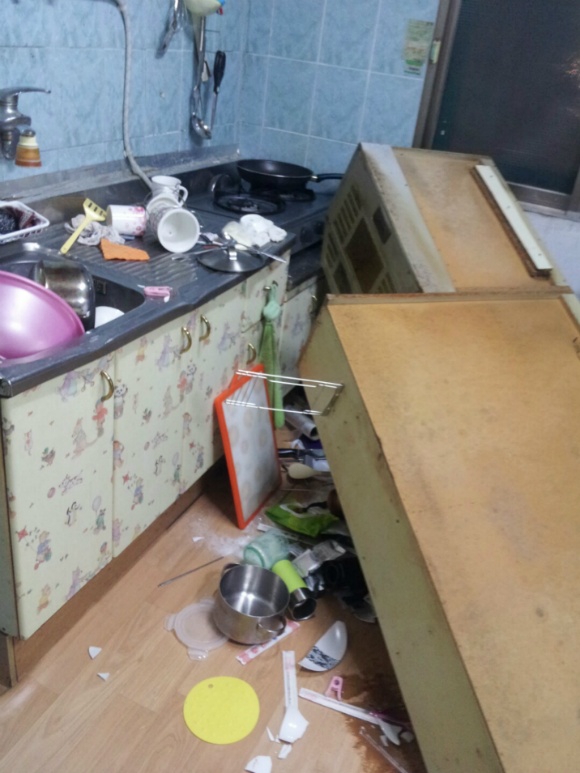
Where is `drawer pull`? drawer pull is located at coordinates (x=264, y=287).